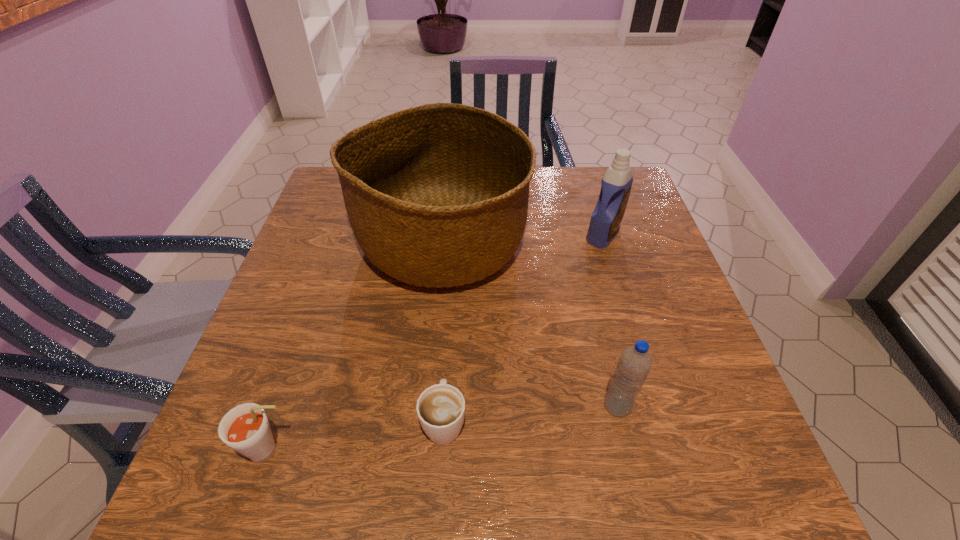
Locate an element on the screen. vacant area at the left edge is located at coordinates (274, 424).

In the image, there is a desktop. Where is `vacant space at the right edge`? vacant space at the right edge is located at coordinates (643, 326).

The height and width of the screenshot is (540, 960). In order to click on vacant region between the fourth tallest object and the basket in this screenshot , I will do `click(355, 347)`.

Locate an element on the screen. vacant area that lies between the basket and the water bottle is located at coordinates (530, 325).

In order to click on vacant area between the fourth shortest object and the cappuccino in this screenshot , I will do `click(523, 328)`.

Locate an element on the screen. The image size is (960, 540). free space between the basket and the second tallest object is located at coordinates (522, 239).

Find the location of a particular element. free space between the basket and the cappuccino is located at coordinates (443, 333).

This screenshot has width=960, height=540. In order to click on vacant space that's between the fourth tallest object and the fourth shortest object in this screenshot , I will do `click(437, 342)`.

This screenshot has width=960, height=540. Identify the location of free spot between the third tallest object and the basket. (530, 325).

Where is `free space between the basket and the fourth shortest object`? The width and height of the screenshot is (960, 540). free space between the basket and the fourth shortest object is located at coordinates (522, 239).